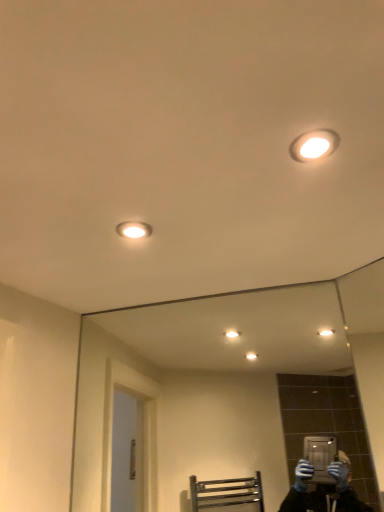
Question: Do you think clear glass mirror at center is within matte white light fixture at upper right, which is the second light fixture from bottom to top, or outside of it?

Choices:
 (A) inside
 (B) outside

Answer: (B)

Question: In terms of size, does clear glass mirror at center appear bigger or smaller than matte white light fixture at upper right, the 2th light fixture from the back?

Choices:
 (A) big
 (B) small

Answer: (A)

Question: Which object is positioned farthest from the matte white light fixture at upper right, the 2th light fixture from the back?

Choices:
 (A) clear glass mirror at center
 (B) matte white light fixture at upper left, which ranks as the first light fixture in left-to-right order

Answer: (A)

Question: Considering the real-world distances, which object is farthest from the matte white light fixture at upper left, positioned as the second light fixture in top-to-bottom order?

Choices:
 (A) matte white light fixture at upper right, which is counted as the 1th light fixture, starting from the right
 (B) clear glass mirror at center

Answer: (B)